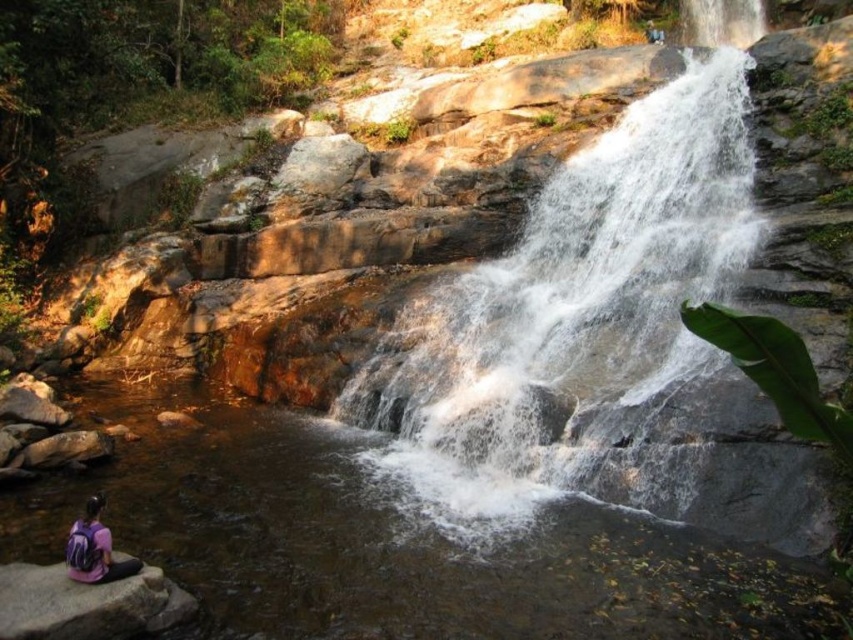
Question: Which object appears closest to the camera in this image?

Choices:
 (A) white frothy water at center
 (B) gray rock at lower left
 (C) purple fabric backpack at lower left

Answer: (B)

Question: Which of these objects is positioned closest to the white frothy water at center?

Choices:
 (A) clear water at center
 (B) gray rock at lower left
 (C) purple fabric backpack at lower left

Answer: (A)

Question: Based on their relative distances, which object is farther from the purple fabric backpack at lower left?

Choices:
 (A) white frothy water at center
 (B) gray rock at lower left
 (C) clear water at center

Answer: (A)

Question: Does white frothy water at center have a larger size compared to purple fabric backpack at lower left?

Choices:
 (A) yes
 (B) no

Answer: (A)

Question: Does clear water at center appear on the right side of purple fabric backpack at lower left?

Choices:
 (A) yes
 (B) no

Answer: (A)

Question: Does clear water at center have a greater width compared to gray rock at lower left?

Choices:
 (A) yes
 (B) no

Answer: (A)